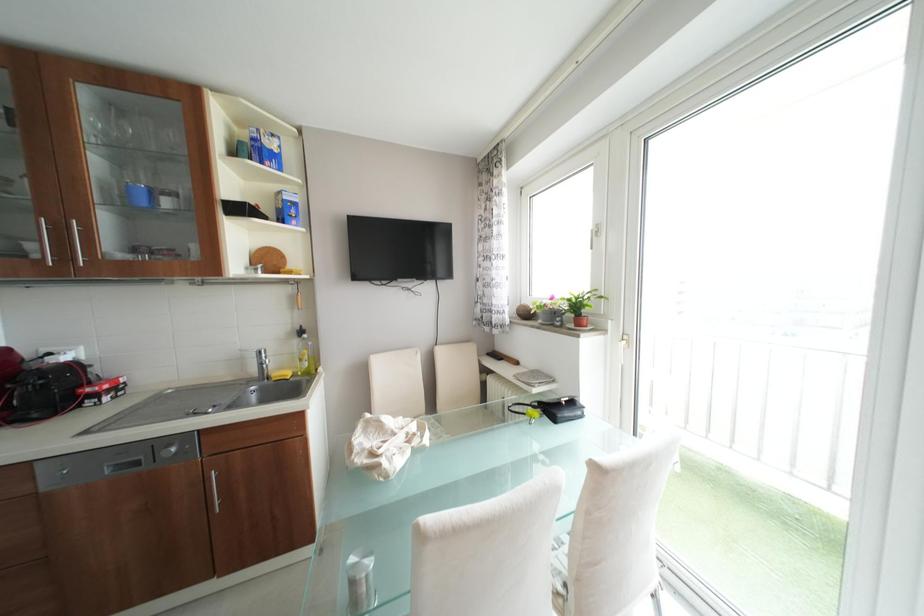
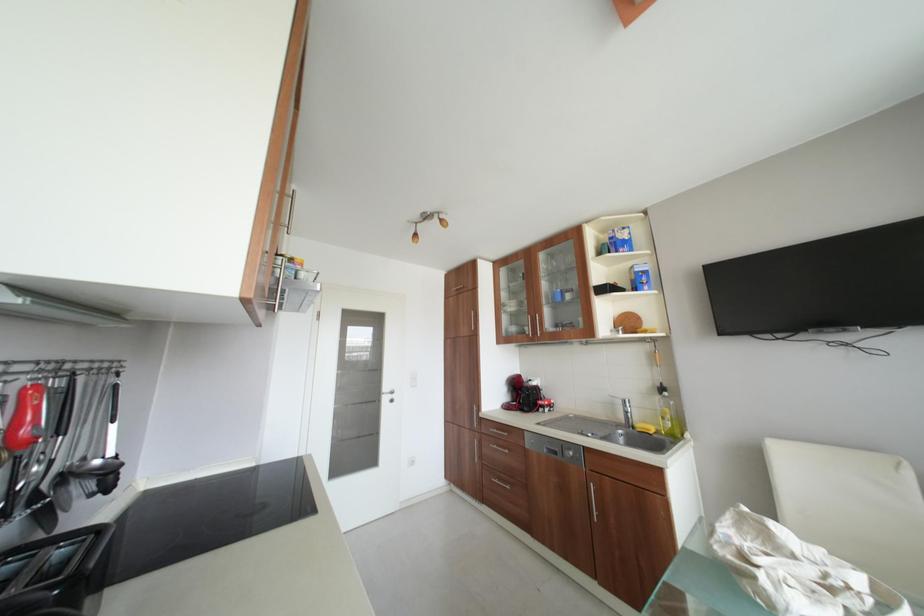
Question: The first image is from the beginning of the video and the second image is from the end. How did the camera likely rotate when shooting the video?

Choices:
 (A) Left
 (B) Right
 (C) Up
 (D) Down

Answer: (A)